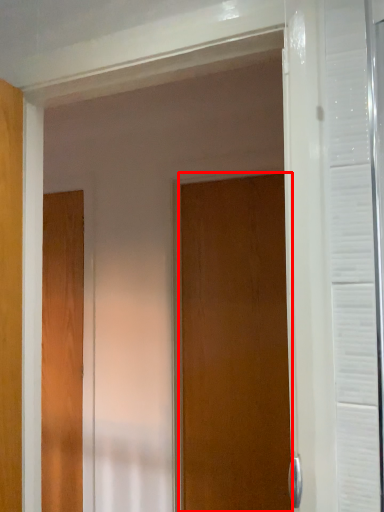
Question: From the image's perspective, considering the relative positions of door (annotated by the red box) and door in the image provided, where is door (annotated by the red box) located with respect to the staircase?

Choices:
 (A) above
 (B) below

Answer: (A)